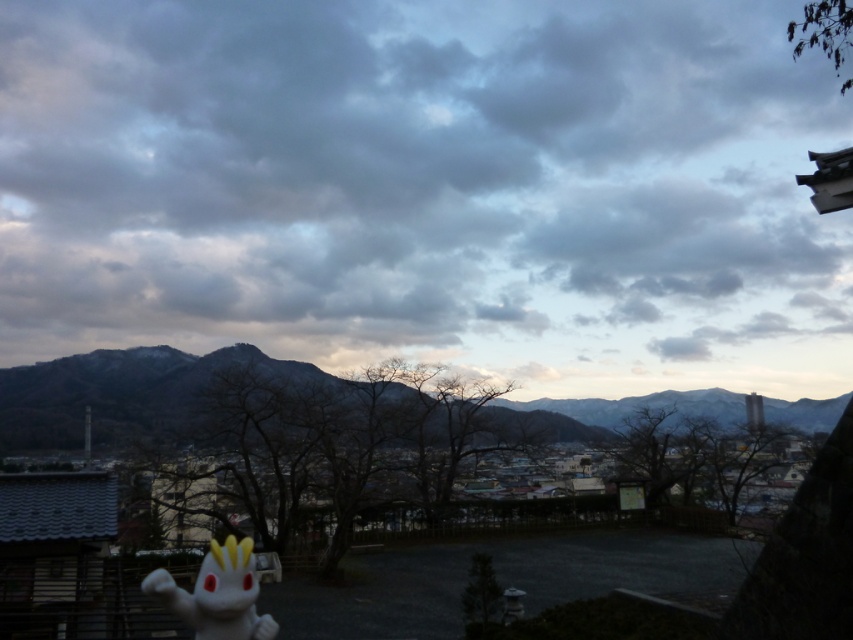
Question: Is matte gray dusk at center behind rocky brown mountain at center?

Choices:
 (A) no
 (B) yes

Answer: (A)

Question: Which object appears closest to the camera in this image?

Choices:
 (A) matte gray dusk at center
 (B) rocky brown mountain at center

Answer: (A)

Question: Does matte gray dusk at center appear on the left side of rocky brown mountain at center?

Choices:
 (A) yes
 (B) no

Answer: (A)

Question: Can you confirm if matte gray dusk at center is positioned below rocky brown mountain at center?

Choices:
 (A) yes
 (B) no

Answer: (B)